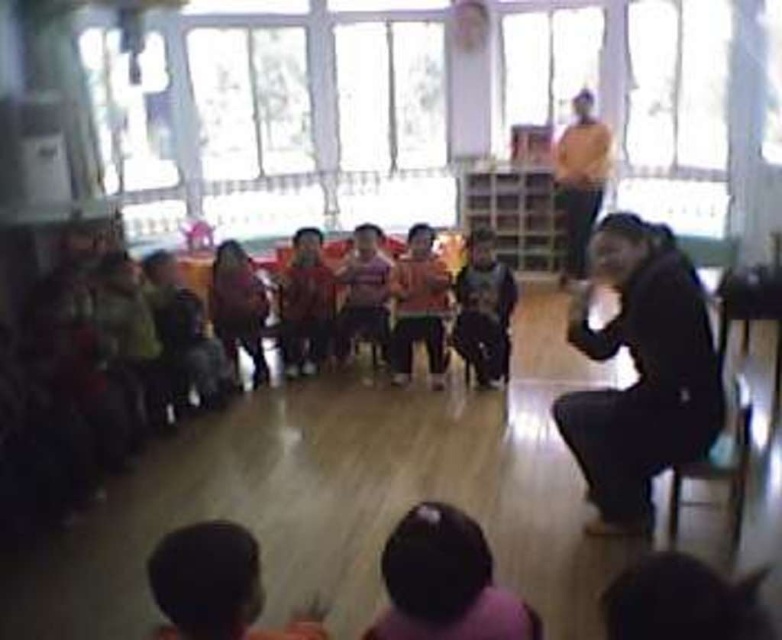
Between dark brown hair at lower left and matte pink shirt at center, which one appears on the left side from the viewer's perspective?

dark brown hair at lower left

Between point (217, 593) and point (414, 292), which one is positioned in front?

Point (217, 593)

You are a GUI agent. You are given a task and a screenshot of the screen. Output one action in this format:
    pyautogui.click(x=<x>, y=<y>)
    Task: Click on the dark brown hair at lower left
    This screenshot has width=782, height=640.
    Given the screenshot: What is the action you would take?
    pyautogui.click(x=217, y=586)

Is point (571, 228) in front of point (750, 419)?

No.

Image resolution: width=782 pixels, height=640 pixels. Identify the location of orange sweater at upper center. (579, 180).

Find the location of a particular element. black matte jacket at lower right is located at coordinates (640, 372).